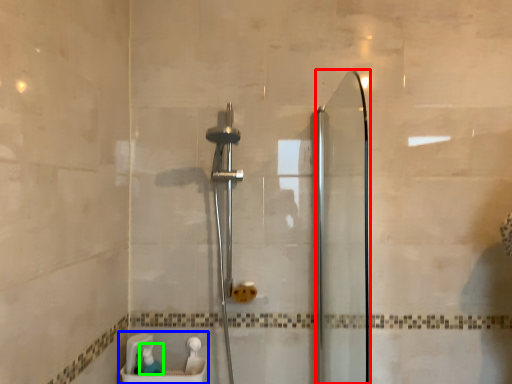
Question: Considering the real-world distances, which object is farthest from screen door (highlighted by a red box)? sink (highlighted by a blue box) or toiletry (highlighted by a green box)?

Choices:
 (A) sink
 (B) toiletry

Answer: (B)